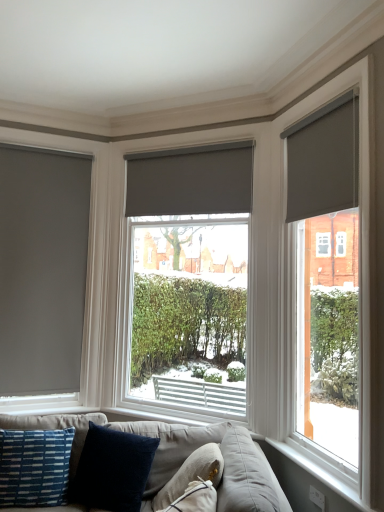
Describe the element at coordinates (323, 160) in the screenshot. This screenshot has width=384, height=512. I see `matte gray roller blind at upper right, which is the 1th window blind in right-to-left order` at that location.

This screenshot has width=384, height=512. Describe the element at coordinates (337, 284) in the screenshot. I see `matte gray roller blind at right, acting as the third window starting from the left` at that location.

The height and width of the screenshot is (512, 384). Describe the element at coordinates (34, 467) in the screenshot. I see `blue woven pillow at lower left, positioned as the first pillow in left-to-right order` at that location.

Locate an element on the screen. matte gray roller blind at center, which appears as the 1th window blind when viewed from the left is located at coordinates (191, 180).

Measure the distance between point [156,460] and camera.

The distance of point [156,460] from camera is 2.62 meters.

Measure the distance between velvet dark blue pillow at lower center, arranged as the second pillow when viewed from the right, and camera.

The distance of velvet dark blue pillow at lower center, arranged as the second pillow when viewed from the right, from camera is 2.47 meters.

You are a GUI agent. You are given a task and a screenshot of the screen. Output one action in this format:
    pyautogui.click(x=<x>, y=<y>)
    Task: Click on the matte gray roller blind at upper right, marked as the 2th window blind in a back-to-front arrangement
    
    Given the screenshot: What is the action you would take?
    pyautogui.click(x=323, y=160)

Looking at their sizes, would you say matte gray blind at left, positioned as the 3th window in right-to-left order, is wider or thinner than blue woven pillow at lower left, the fourth pillow viewed from the right?

matte gray blind at left, positioned as the 3th window in right-to-left order, is thinner than blue woven pillow at lower left, the fourth pillow viewed from the right.

From a real-world perspective, is matte gray blind at left, marked as the first window in a left-to-right arrangement, located higher than blue woven pillow at lower left, positioned as the first pillow in left-to-right order?

Yes, from a real-world perspective, matte gray blind at left, marked as the first window in a left-to-right arrangement, is on top of blue woven pillow at lower left, positioned as the first pillow in left-to-right order.

From the image's perspective, would you say matte gray blind at left, marked as the first window in a left-to-right arrangement, is shown under blue woven pillow at lower left, positioned as the first pillow in left-to-right order?

Incorrect, from the image's perspective, matte gray blind at left, marked as the first window in a left-to-right arrangement, is higher than blue woven pillow at lower left, positioned as the first pillow in left-to-right order.

Is matte gray blind at left, positioned as the 3th window in right-to-left order, far away from blue woven pillow at lower left, positioned as the first pillow in left-to-right order?

Yes, matte gray blind at left, positioned as the 3th window in right-to-left order, is far from blue woven pillow at lower left, positioned as the first pillow in left-to-right order.

Is velvet dark blue pillow at lower center, arranged as the second pillow when viewed from the right, to the left of velvety dark blue pillow at lower center, placed as the 3th pillow when sorted from right to left, from the viewer's perspective?

In fact, velvet dark blue pillow at lower center, arranged as the second pillow when viewed from the right, is to the right of velvety dark blue pillow at lower center, placed as the 3th pillow when sorted from right to left.

Is velvet dark blue pillow at lower center, arranged as the second pillow when viewed from the right, completely or partially outside of velvety dark blue pillow at lower center, the second pillow positioned from the left?

Yes, velvet dark blue pillow at lower center, arranged as the second pillow when viewed from the right, is located beyond the bounds of velvety dark blue pillow at lower center, the second pillow positioned from the left.

From the image's perspective, is velvet dark blue pillow at lower center, arranged as the 3th pillow when viewed from the left, on top of velvety dark blue pillow at lower center, the second pillow positioned from the left?

Yes, from the image's perspective, velvet dark blue pillow at lower center, arranged as the 3th pillow when viewed from the left, is over velvety dark blue pillow at lower center, the second pillow positioned from the left.

What's the angular difference between velvet dark blue pillow at lower center, arranged as the 3th pillow when viewed from the left, and velvety dark blue pillow at lower center, placed as the 3th pillow when sorted from right to left,'s facing directions?

82.7 degrees.

Considering the relative positions of matte gray roller blind at center, which appears as the 1th window blind when viewed from the left, and matte gray blind at left, positioned as the 3th window in right-to-left order, in the image provided, is matte gray roller blind at center, which appears as the 1th window blind when viewed from the left, in front of matte gray blind at left, positioned as the 3th window in right-to-left order,?

Yes, matte gray roller blind at center, which appears as the 1th window blind when viewed from the left, is in front of matte gray blind at left, positioned as the 3th window in right-to-left order.

Between matte gray roller blind at center, which appears as the 1th window blind when viewed from the left, and matte gray blind at left, marked as the first window in a left-to-right arrangement, which one has smaller width?

With smaller width is matte gray roller blind at center, which appears as the 1th window blind when viewed from the left.

Does matte gray roller blind at center, which appears as the 1th window blind when viewed from the left, appear on the left side of matte gray blind at left, positioned as the 3th window in right-to-left order?

Incorrect, matte gray roller blind at center, which appears as the 1th window blind when viewed from the left, is not on the left side of matte gray blind at left, positioned as the 3th window in right-to-left order.

Who is smaller, matte gray roller blind at center, which appears as the 1th window blind when viewed from the left, or matte gray blind at left, positioned as the 3th window in right-to-left order?

Smaller between the two is matte gray roller blind at center, which appears as the 1th window blind when viewed from the left.

Which is more to the right, matte gray roller blind at upper right, marked as the second window blind in a left-to-right arrangement, or matte gray roller blind at center, the first window blind positioned from the back?

matte gray roller blind at upper right, marked as the second window blind in a left-to-right arrangement.

Looking at this image, is matte gray roller blind at upper right, which is the 1th window blind in right-to-left order, in front of matte gray roller blind at center, which appears as the 1th window blind when viewed from the left?

Yes, it is in front of matte gray roller blind at center, which appears as the 1th window blind when viewed from the left.

I want to click on window blind behind the matte gray roller blind at upper right, marked as the second window blind in a left-to-right arrangement, so click(x=191, y=180).

Considering the sizes of matte gray roller blind at right, marked as the first window in a right-to-left arrangement, and velvet dark blue pillow at lower center, arranged as the 3th pillow when viewed from the left, in the image, is matte gray roller blind at right, marked as the first window in a right-to-left arrangement, taller or shorter than velvet dark blue pillow at lower center, arranged as the 3th pillow when viewed from the left,?

matte gray roller blind at right, marked as the first window in a right-to-left arrangement, is taller than velvet dark blue pillow at lower center, arranged as the 3th pillow when viewed from the left.

Is matte gray roller blind at right, acting as the third window starting from the left, turned away from velvet dark blue pillow at lower center, arranged as the second pillow when viewed from the right?

No.

Is matte gray roller blind at right, acting as the third window starting from the left, not inside velvet dark blue pillow at lower center, arranged as the 3th pillow when viewed from the left?

Absolutely, matte gray roller blind at right, acting as the third window starting from the left, is external to velvet dark blue pillow at lower center, arranged as the 3th pillow when viewed from the left.

Which object is wider, velvet dark blue pillow at lower center, arranged as the second pillow when viewed from the right, or matte gray roller blind at right, acting as the third window starting from the left?

With larger width is velvet dark blue pillow at lower center, arranged as the second pillow when viewed from the right.

From the image's perspective, who appears lower, velvet dark blue pillow at lower center, arranged as the 3th pillow when viewed from the left, or matte gray roller blind at right, acting as the third window starting from the left?

velvet dark blue pillow at lower center, arranged as the 3th pillow when viewed from the left, is shown below in the image.

Where is `the 1st window behind the velvet dark blue pillow at lower center, arranged as the 3th pillow when viewed from the left, counting from the anchor's position`? the 1st window behind the velvet dark blue pillow at lower center, arranged as the 3th pillow when viewed from the left, counting from the anchor's position is located at coordinates (337, 284).

Would you say velvet dark blue pillow at lower center, arranged as the second pillow when viewed from the right, is inside or outside matte gray roller blind at right, acting as the third window starting from the left?

velvet dark blue pillow at lower center, arranged as the second pillow when viewed from the right, lies outside matte gray roller blind at right, acting as the third window starting from the left.

Is matte gray blind at left, marked as the first window in a left-to-right arrangement, far from soft gray fabric couch at lower center?

Absolutely, matte gray blind at left, marked as the first window in a left-to-right arrangement, is distant from soft gray fabric couch at lower center.

Considering the sizes of objects matte gray blind at left, positioned as the 3th window in right-to-left order, and soft gray fabric couch at lower center in the image provided, who is shorter, matte gray blind at left, positioned as the 3th window in right-to-left order, or soft gray fabric couch at lower center?

With less height is soft gray fabric couch at lower center.

Does matte gray blind at left, marked as the first window in a left-to-right arrangement, come behind soft gray fabric couch at lower center?

Yes, it is.

Considering the relative positions of matte gray blind at left, marked as the first window in a left-to-right arrangement, and soft gray fabric couch at lower center in the image provided, is matte gray blind at left, marked as the first window in a left-to-right arrangement, to the left or to the right of soft gray fabric couch at lower center?

From the image, it's evident that matte gray blind at left, marked as the first window in a left-to-right arrangement, is to the left of soft gray fabric couch at lower center.

You are a GUI agent. You are given a task and a screenshot of the screen. Output one action in this format:
    pyautogui.click(x=<x>, y=<y>)
    Task: Click on the pillow that is the 2nd object located in front of the matte gray blind at left, positioned as the 3th window in right-to-left order
    Image resolution: width=384 pixels, height=512 pixels.
    Given the screenshot: What is the action you would take?
    pyautogui.click(x=34, y=467)

This screenshot has height=512, width=384. Identify the location of the 1st pillow counting from the right side of the velvety dark blue pillow at lower center, placed as the 3th pillow when sorted from right to left. (170, 446).

From the picture: Considering their positions, is velvety dark blue pillow at lower center, the second pillow positioned from the left, positioned closer to velvet dark blue pillow at lower center, arranged as the 3th pillow when viewed from the left, than matte gray blind at left, marked as the first window in a left-to-right arrangement?

velvety dark blue pillow at lower center, the second pillow positioned from the left.

Estimate the real-world distances between objects in this image. Which object is further from matte gray roller blind at right, acting as the third window starting from the left, soft gray fabric couch at lower center or velvet dark blue pillow at lower center, arranged as the 3th pillow when viewed from the left?

Among the two, soft gray fabric couch at lower center is located further to matte gray roller blind at right, acting as the third window starting from the left.

Based on their spatial positions, is velvet dark blue pillow at lower center, arranged as the second pillow when viewed from the right, or white plastic window sill at lower right further from matte gray roller blind at right, acting as the third window starting from the left?

The object further to matte gray roller blind at right, acting as the third window starting from the left, is velvet dark blue pillow at lower center, arranged as the second pillow when viewed from the right.

Based on their spatial positions, is velvety dark blue pillow at lower center, placed as the 3th pillow when sorted from right to left, or blue woven pillow at lower left, the fourth pillow viewed from the right, further from matte gray roller blind at right, acting as the third window starting from the left?

The object further to matte gray roller blind at right, acting as the third window starting from the left, is blue woven pillow at lower left, the fourth pillow viewed from the right.

When comparing their distances from velvety dark blue pillow at lower center, the second pillow positioned from the left, does matte gray roller blind at right, acting as the third window starting from the left, or velvet dark blue pillow at lower center, arranged as the 3th pillow when viewed from the left, seem further?

matte gray roller blind at right, acting as the third window starting from the left.

Which object lies further to the anchor point matte gray blind at left, marked as the first window in a left-to-right arrangement, white plastic window sill at lower right or matte gray roller blind at center, marked as the 2th window in a right-to-left arrangement?

white plastic window sill at lower right lies further to matte gray blind at left, marked as the first window in a left-to-right arrangement, than the other object.

Considering their positions, is soft gray fabric couch at lower center positioned further to matte gray roller blind at right, acting as the third window starting from the left, than blue woven pillow at lower left, positioned as the first pillow in left-to-right order?

blue woven pillow at lower left, positioned as the first pillow in left-to-right order, is positioned further to the anchor matte gray roller blind at right, acting as the third window starting from the left.

Based on the photo, when comparing their distances from white plastic window sill at lower right, does soft gray fabric couch at lower center or matte gray roller blind at right, acting as the third window starting from the left, seem closer?

matte gray roller blind at right, acting as the third window starting from the left.

I want to click on studio couch between velvet dark blue pillow at lower center, arranged as the second pillow when viewed from the right, and matte gray blind at left, marked as the first window in a left-to-right arrangement, along the z-axis, so click(183, 458).

This screenshot has height=512, width=384. In order to click on window sill between matte gray roller blind at upper right, placed as the first window blind when sorted from front to back, and soft gray fabric couch at lower center vertically in this screenshot , I will do `click(307, 480)`.

This screenshot has height=512, width=384. Identify the location of window blind between matte gray roller blind at center, marked as the 2th window in a right-to-left arrangement, and matte gray roller blind at upper right, which is the 1th window blind in right-to-left order. (191, 180).

Locate an element on the screen. This screenshot has width=384, height=512. window sill between matte gray roller blind at right, marked as the first window in a right-to-left arrangement, and soft gray fabric couch at lower center vertically is located at coordinates (307, 480).